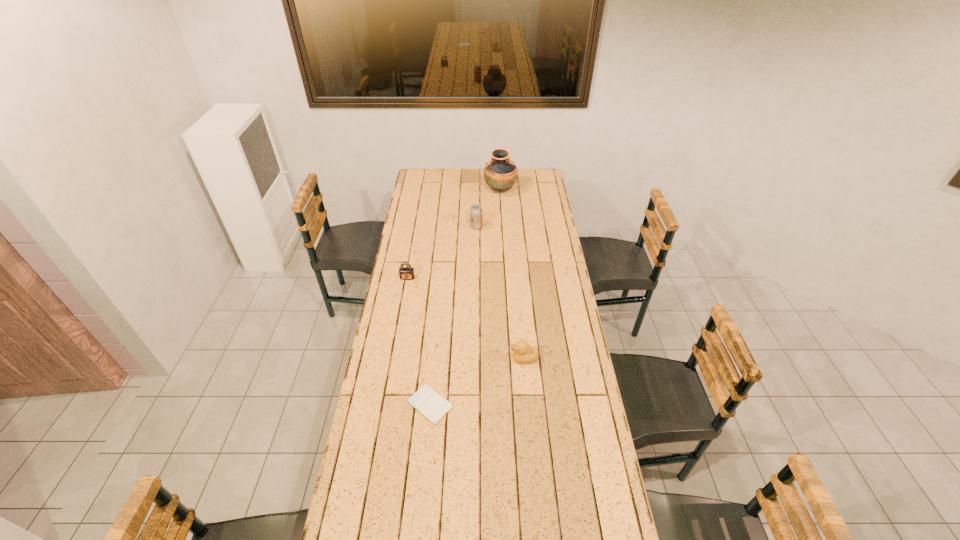
Locate an element on the screen. the tallest object is located at coordinates (500, 174).

This screenshot has height=540, width=960. Identify the location of the farthest object. (500, 174).

The height and width of the screenshot is (540, 960). In order to click on the second tallest object in this screenshot , I will do `click(476, 212)`.

The image size is (960, 540). In order to click on the second farthest object in this screenshot , I will do point(476,212).

Identify the location of duckling. The width and height of the screenshot is (960, 540). (523, 353).

You are a GUI agent. You are given a task and a screenshot of the screen. Output one action in this format:
    pyautogui.click(x=<x>, y=<y>)
    Task: Click on the padlock
    This screenshot has width=960, height=540.
    Given the screenshot: What is the action you would take?
    pyautogui.click(x=406, y=273)

What are the coordinates of `the third farthest object` in the screenshot? It's located at (406, 273).

At what (x,y) coordinates should I click in order to perform the action: click on the second object from left to right. Please return your answer as a coordinate pair (x, y). Looking at the image, I should click on (433, 406).

The image size is (960, 540). In order to click on calculator in this screenshot , I will do `click(433, 406)`.

Where is `free region located 0.260m on the front of the pottery`? The image size is (960, 540). free region located 0.260m on the front of the pottery is located at coordinates (502, 226).